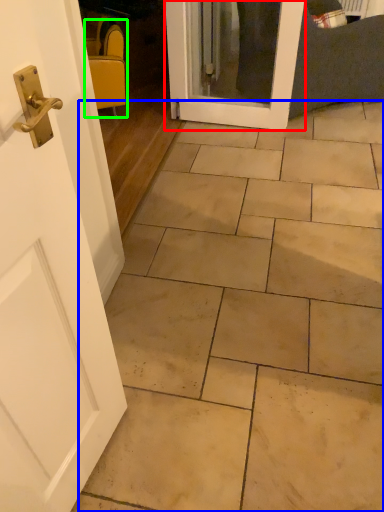
Question: Based on their relative distances, which object is farther from door (highlighted by a red box)? Choose from ceramic tile (highlighted by a blue box) and chair (highlighted by a green box).

Choices:
 (A) ceramic tile
 (B) chair

Answer: (A)